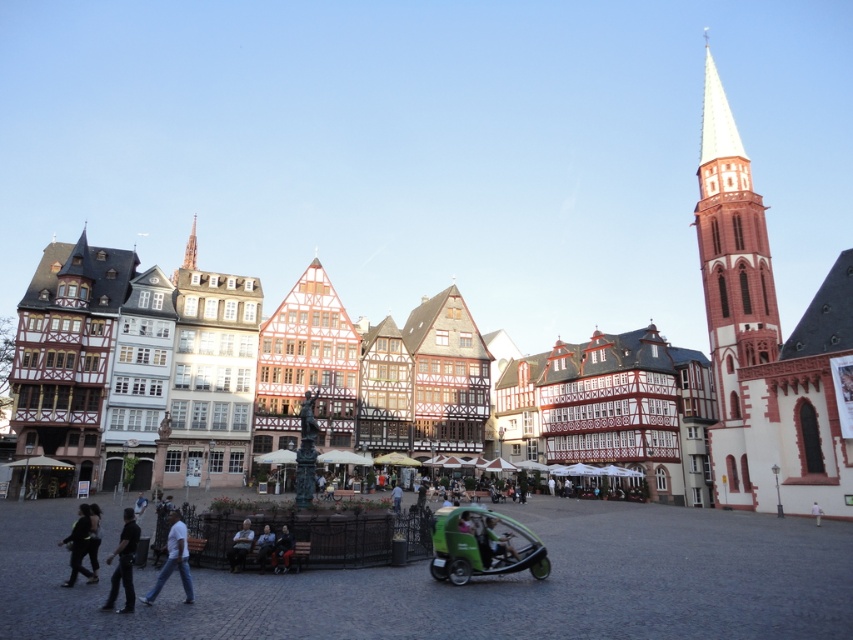
Is the position of white cotton shirt at lower left more distant than that of light brown wooden bench at lower center?

That is False.

What do you see at coordinates (173, 560) in the screenshot? The width and height of the screenshot is (853, 640). I see `white cotton shirt at lower left` at bounding box center [173, 560].

Is point (177, 518) positioned in front of point (289, 544)?

Yes.

Locate an element on the screen. The height and width of the screenshot is (640, 853). white cotton shirt at lower left is located at coordinates (173, 560).

Can you confirm if green matte tricycle at lower center is wider than green fabric cart at center?

Correct, the width of green matte tricycle at lower center exceeds that of green fabric cart at center.

Between green matte tricycle at lower center and green fabric cart at center, which one has less height?

green fabric cart at center is shorter.

Find the location of `green matte tricycle at lower center`. green matte tricycle at lower center is located at coordinates (480, 545).

Looking at this image, does dark green fabric jacket at lower left have a greater width compared to green fabric cart at center?

Indeed, dark green fabric jacket at lower left has a greater width compared to green fabric cart at center.

Which is behind, point (94, 573) or point (508, 554)?

The point (508, 554) is behind.

What do you see at coordinates (79, 547) in the screenshot? I see `dark green fabric jacket at lower left` at bounding box center [79, 547].

Image resolution: width=853 pixels, height=640 pixels. Identify the location of dark green fabric jacket at lower left. (79, 547).